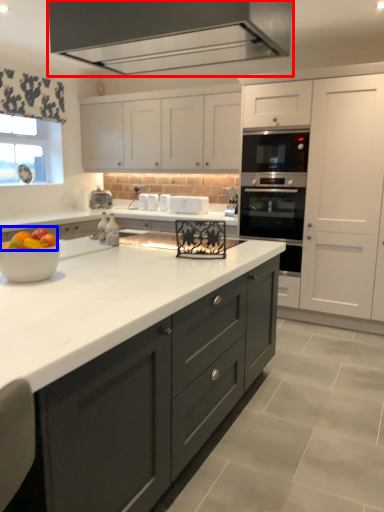
Question: Among these objects, which one is farthest to the camera, exhaust hood (highlighted by a red box) or fruit (highlighted by a blue box)?

Choices:
 (A) exhaust hood
 (B) fruit

Answer: (A)